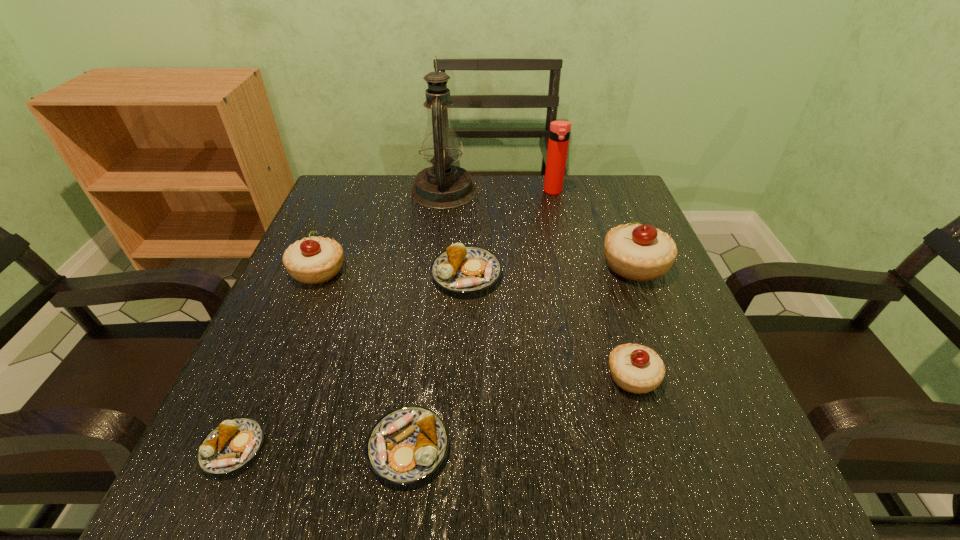
At what (x,y) coordinates should I click in order to perform the action: click on free point between the second shortest pastry and the biggest brown pastry. Please return your answer as a coordinate pair (x, y). The width and height of the screenshot is (960, 540). Looking at the image, I should click on (438, 361).

Where is `empty space between the third nearest pastry and the third tallest object`? This screenshot has height=540, width=960. empty space between the third nearest pastry and the third tallest object is located at coordinates (634, 320).

Find the location of a particular element. The width and height of the screenshot is (960, 540). empty location between the fifth shortest object and the leftmost brown pastry is located at coordinates (276, 360).

You are a GUI agent. You are given a task and a screenshot of the screen. Output one action in this format:
    pyautogui.click(x=<x>, y=<y>)
    Task: Click on the unoccupied position between the shortest object and the sixth shortest object
    
    Given the screenshot: What is the action you would take?
    pyautogui.click(x=434, y=356)

Find the location of a particular element. free point between the second tallest object and the second tallest pastry is located at coordinates (436, 231).

The height and width of the screenshot is (540, 960). Find the location of `empty location between the sixth farthest object and the sixth shortest object`. empty location between the sixth farthest object and the sixth shortest object is located at coordinates (634, 320).

Image resolution: width=960 pixels, height=540 pixels. I want to click on free space between the shortest object and the biggest beige pastry, so click(434, 356).

Locate an element on the screen. This screenshot has height=540, width=960. vacant space that is in between the second shortest pastry and the third shortest object is located at coordinates (438, 361).

Locate an element on the screen. The height and width of the screenshot is (540, 960). free space between the tallest pastry and the biggest brown pastry is located at coordinates (551, 269).

Identify which object is the fifth nearest to the thermos bottle. Please provide its 2D coordinates. Your answer should be formatted as a tuple, i.e. [(x, y)], where the tuple contains the x and y coordinates of a point satisfying the conditions above.

[(635, 368)]